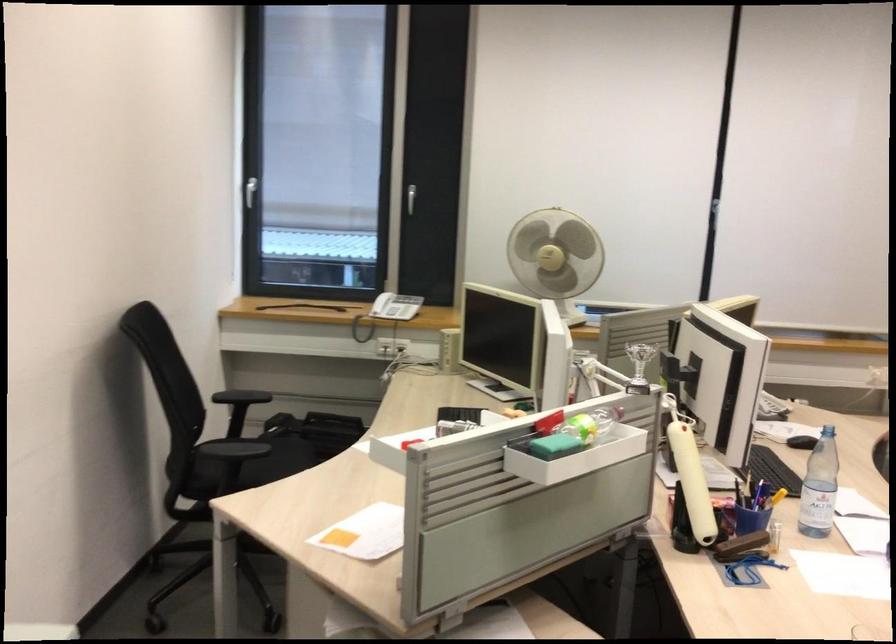
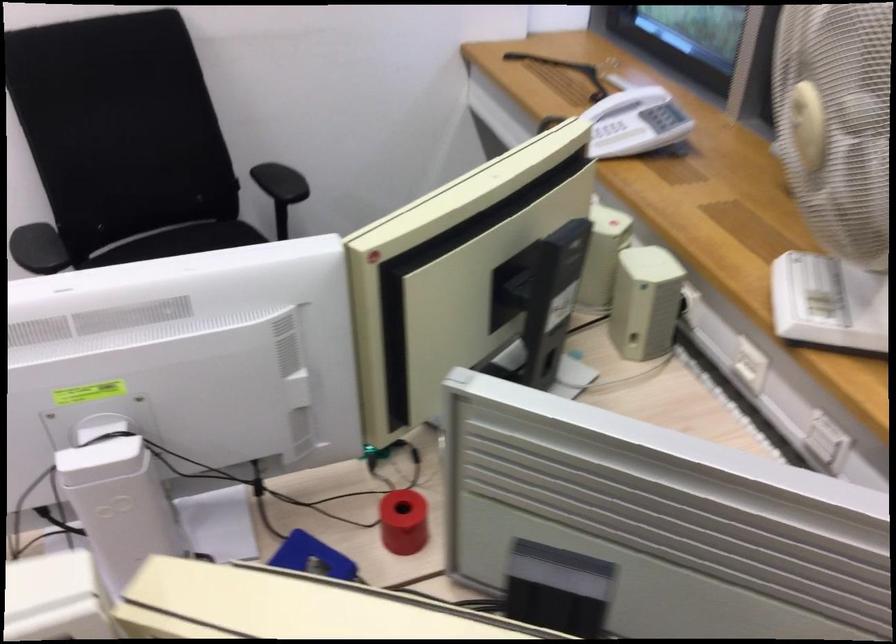
Where in the second image is the point corresponding to pixel 572 371 from the first image?

(118, 500)